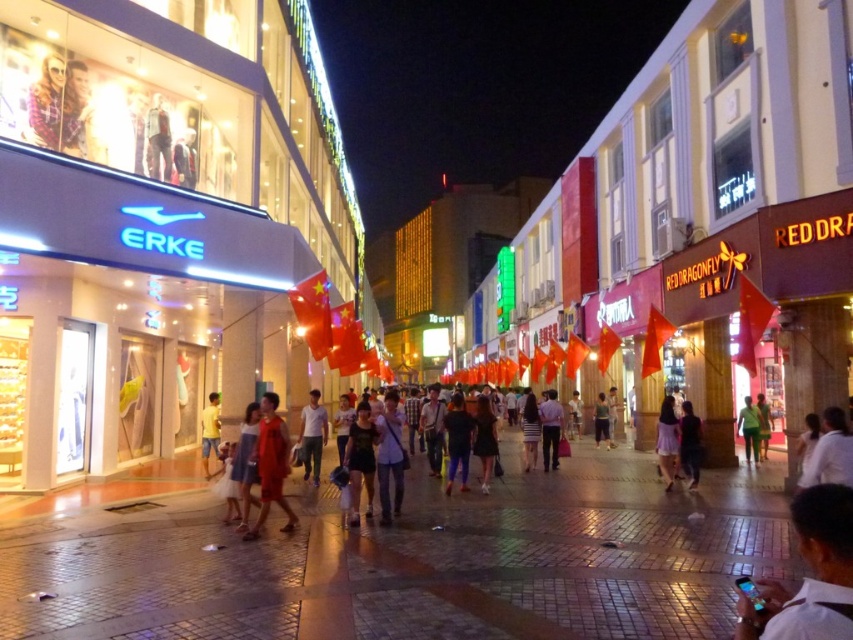
Question: Which point is farther to the camera?

Choices:
 (A) dark blue jeans at center
 (B) white shirt at lower right
 (C) red satin dress at center

Answer: (A)

Question: Where is dark blue jeans at center located in relation to yellow cotton shorts at center in the image?

Choices:
 (A) right
 (B) left

Answer: (A)

Question: Is dark blue dress at center positioned in front of dark blue jeans at center?

Choices:
 (A) no
 (B) yes

Answer: (A)

Question: Which object is positioned closest to the dark blue jeans at center?

Choices:
 (A) yellow cotton shorts at center
 (B) green fabric pants at center
 (C) white shirt at center

Answer: (B)

Question: Does white cotton shirt at center appear under yellow cotton shorts at center?

Choices:
 (A) no
 (B) yes

Answer: (A)

Question: Which point appears farthest from the camera in this image?

Choices:
 (A) (751, 416)
 (B) (672, 467)

Answer: (A)